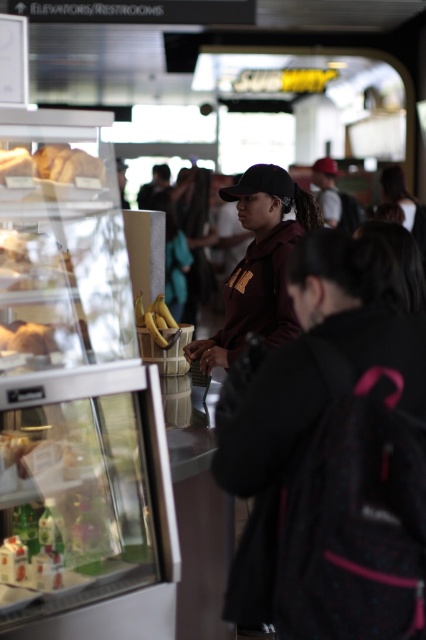
Is maroon hoodie at center taller than matte brown bread at upper left?

Yes, maroon hoodie at center is taller than matte brown bread at upper left.

Is maroon hoodie at center to the left of matte brown bread at upper left from the viewer's perspective?

No, maroon hoodie at center is not to the left of matte brown bread at upper left.

This screenshot has width=426, height=640. In order to click on maroon hoodie at center in this screenshot , I will do `click(333, 456)`.

Who is positioned more to the left, maroon hoodie at center or yellow matte bananas at center?

yellow matte bananas at center is more to the left.

Is maroon hoodie at center thinner than yellow matte bananas at center?

No.

Where is `maroon hoodie at center`? The image size is (426, 640). maroon hoodie at center is located at coordinates (333, 456).

This screenshot has height=640, width=426. Find the location of `maroon hoodie at center`. maroon hoodie at center is located at coordinates (333, 456).

Does maroon fabric shirt at center appear under black matte baseball cap at center?

Yes.

Is point (288, 237) positioned behind point (244, 193)?

No, (288, 237) is closer to viewer.

Find the location of a particular element. maroon fabric shirt at center is located at coordinates (259, 264).

Where is `maroon fabric shirt at center`? maroon fabric shirt at center is located at coordinates (259, 264).